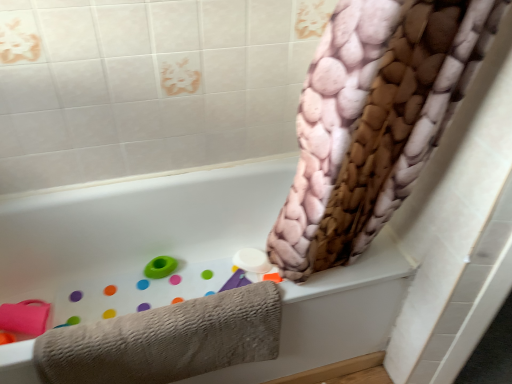
Question: Is white matte bathtub at upper center spatially inside beige textured towel at lower left, or outside of it?

Choices:
 (A) inside
 (B) outside

Answer: (B)

Question: Is white matte bathtub at upper center in front of or behind beige textured towel at lower left in the image?

Choices:
 (A) front
 (B) behind

Answer: (A)

Question: Estimate the real-world distances between objects in this image. Which object is farther from the beige textured towel at lower left?

Choices:
 (A) white matte bathtub at upper center
 (B) green rubber ring at lower left

Answer: (B)

Question: Which is nearer to the green rubber ring at lower left?

Choices:
 (A) white matte bathtub at upper center
 (B) beige textured towel at lower left

Answer: (A)